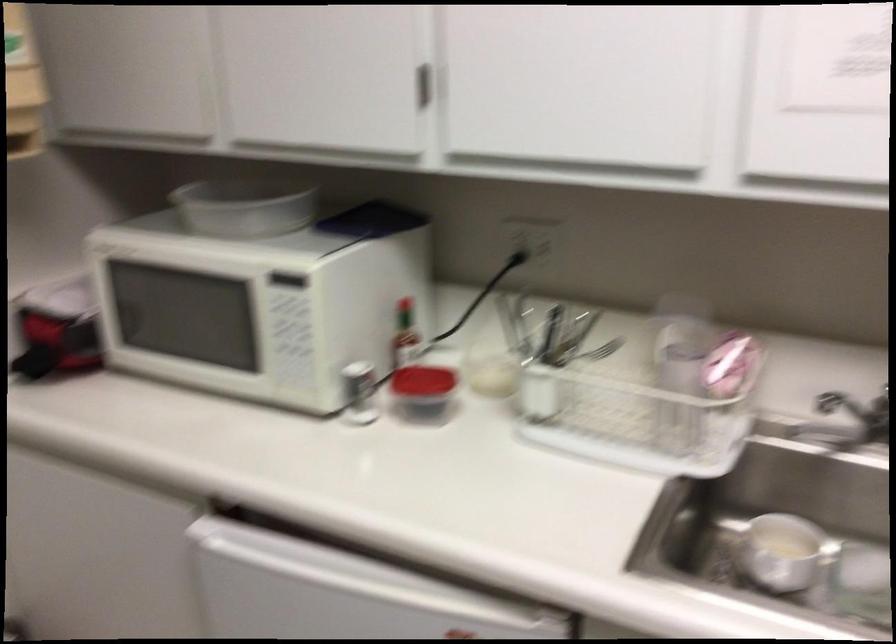
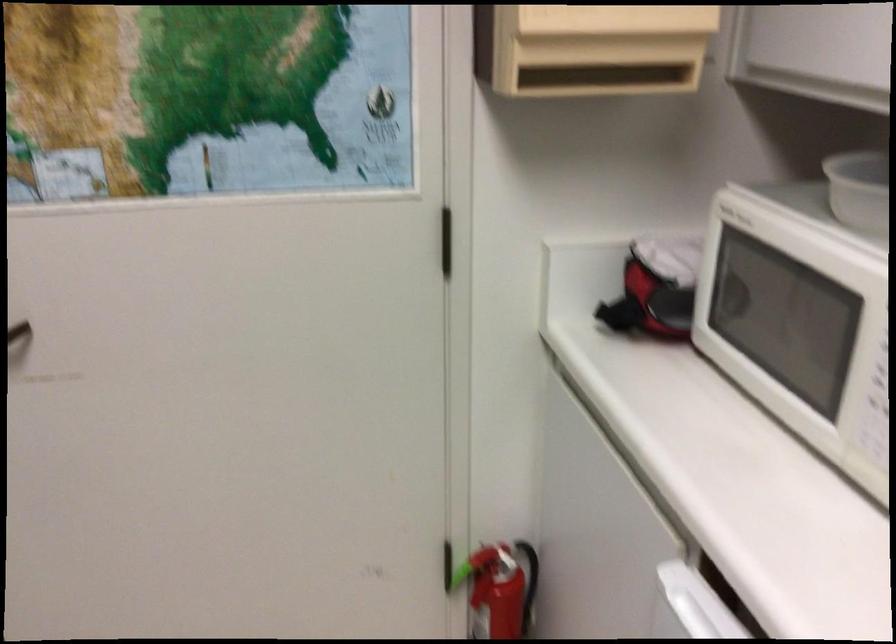
Question: The first image is from the beginning of the video and the second image is from the end. How did the camera likely rotate when shooting the video?

Choices:
 (A) Left
 (B) Right
 (C) Up
 (D) Down

Answer: (A)